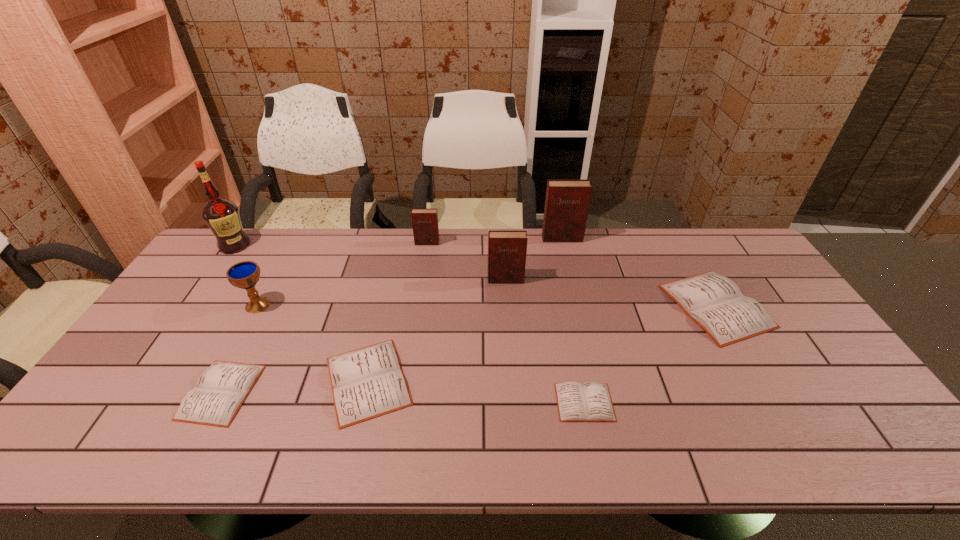
At what (x,y) coordinates should I click in order to perform the action: click on the leftmost object. Please return your answer as a coordinate pair (x, y). Looking at the image, I should click on (222, 216).

Find the location of `brown alcohol`. brown alcohol is located at coordinates (222, 216).

Where is `the biggest reddish-brown diary`? This screenshot has height=540, width=960. the biggest reddish-brown diary is located at coordinates (567, 202).

At what (x,y) coordinates should I click in order to perform the action: click on the tallest diary. Please return your answer as a coordinate pair (x, y). Looking at the image, I should click on (567, 202).

At what (x,y) coordinates should I click in order to perform the action: click on the second reddish-brown diary from left to right. Please return your answer as a coordinate pair (x, y). Looking at the image, I should click on (507, 250).

Find the location of a particular element. This screenshot has width=960, height=540. the second biggest reddish-brown diary is located at coordinates (507, 250).

Identify the location of blue chalice. The width and height of the screenshot is (960, 540). (244, 275).

Identify the location of the fifth shortest diary. The height and width of the screenshot is (540, 960). (424, 221).

Locate an element on the screen. the leftmost reddish-brown diary is located at coordinates (424, 221).

Where is `the rightmost object`? Image resolution: width=960 pixels, height=540 pixels. the rightmost object is located at coordinates (716, 303).